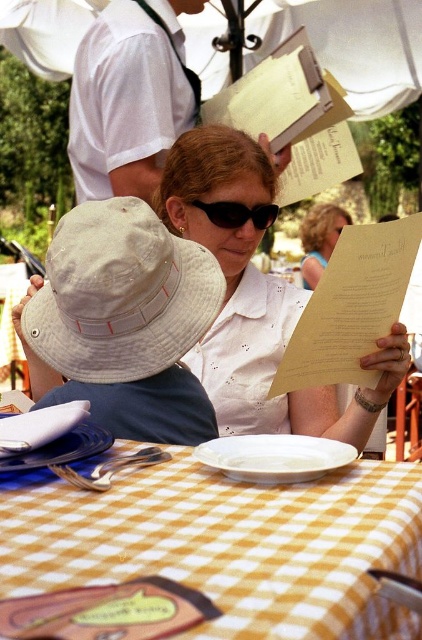
Which of these two, white paper menu at center or sunglasses at center, stands taller?

Standing taller between the two is white paper menu at center.

Does white paper menu at center appear over sunglasses at center?

No.

Is point (208, 141) positioned before point (262, 216)?

Yes.

Locate an element on the screen. This screenshot has height=640, width=422. white paper menu at center is located at coordinates (259, 301).

Between point (246, 276) and point (159, 132), which one is positioned behind?

The point (159, 132) is behind.

Which is in front, point (178, 156) or point (102, 67)?

Point (178, 156) is in front.

Is point (240, 333) behind point (165, 129)?

No, it is in front of (165, 129).

The image size is (422, 640). Identify the location of white paper menu at center. (259, 301).

In the scene shown: Can you confirm if white paper menu at center is positioned to the left of matte white paper at center?

Yes, white paper menu at center is to the left of matte white paper at center.

Is white paper menu at center thinner than matte white paper at center?

No.

Is point (267, 179) in front of point (343, 218)?

Yes.

Locate an element on the screen. white paper menu at center is located at coordinates (259, 301).